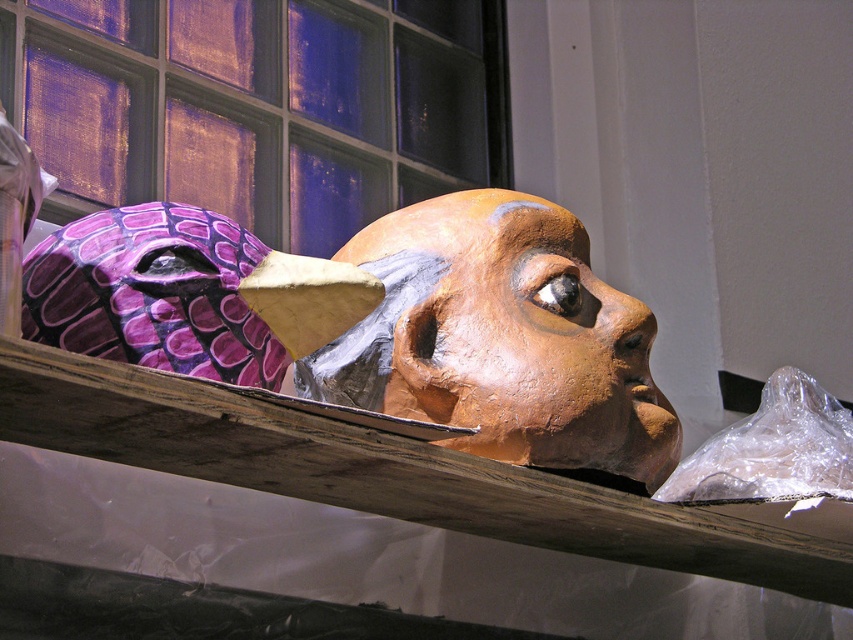
Question: Which object is positioned closest to the matte purple/scaly dragon head at center?

Choices:
 (A) matte brown mask at center
 (B) blue glass window at upper center

Answer: (A)

Question: Which point is closer to the camera?

Choices:
 (A) (490, 228)
 (B) (73, 77)
 (C) (646, 454)

Answer: (C)

Question: Is blue glass window at upper center thinner than matte brown mask at center?

Choices:
 (A) no
 (B) yes

Answer: (A)

Question: Is matte purple/scaly dragon head at center positioned in front of matte brown mask at center?

Choices:
 (A) yes
 (B) no

Answer: (A)

Question: Which point is farther from the camera taking this photo?

Choices:
 (A) (236, 56)
 (B) (492, 420)

Answer: (A)

Question: Is matte purple/scaly dragon head at center bigger than matte brown mask at center?

Choices:
 (A) no
 (B) yes

Answer: (B)